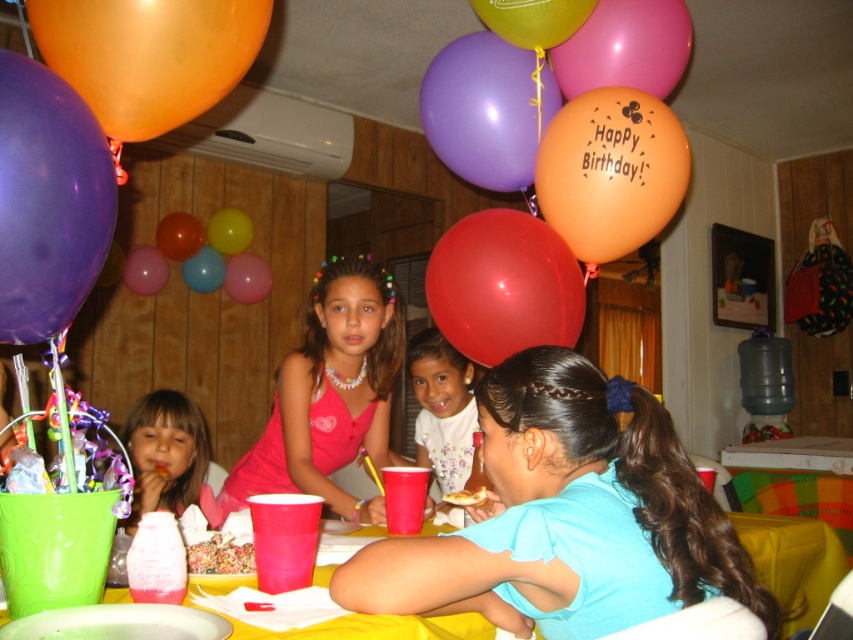
You are a photographer at the birthday party and want to take a photo of the pink satin dress at center. Where should you position your camera to capture the dress perfectly?

The pink satin dress at center is located at the 2D coordinates point (329, 394), so the camera should be positioned directly facing that point to capture the dress perfectly.

You are a photographer at the birthday party. You want to capture a photo that includes both the purple matte balloon at upper center and the white floral dress at center. Which object should be placed wider in the frame to ensure both are fully visible?

The purple matte balloon at upper center is wider than the white floral dress at center. To ensure both are fully visible in the photo, the purple matte balloon at upper center should be placed wider in the frame since it has a greater width compared to the white floral dress at center.

You are planning to hang a small decoration from the ceiling directly above the purple matte balloon at upper center. According to the coordinates provided, where should you place the decoration to ensure it hangs exactly above the balloon?

The purple matte balloon at upper center is located at point (486,109), so you should place the decoration at the same coordinates to ensure it hangs directly above the balloon.